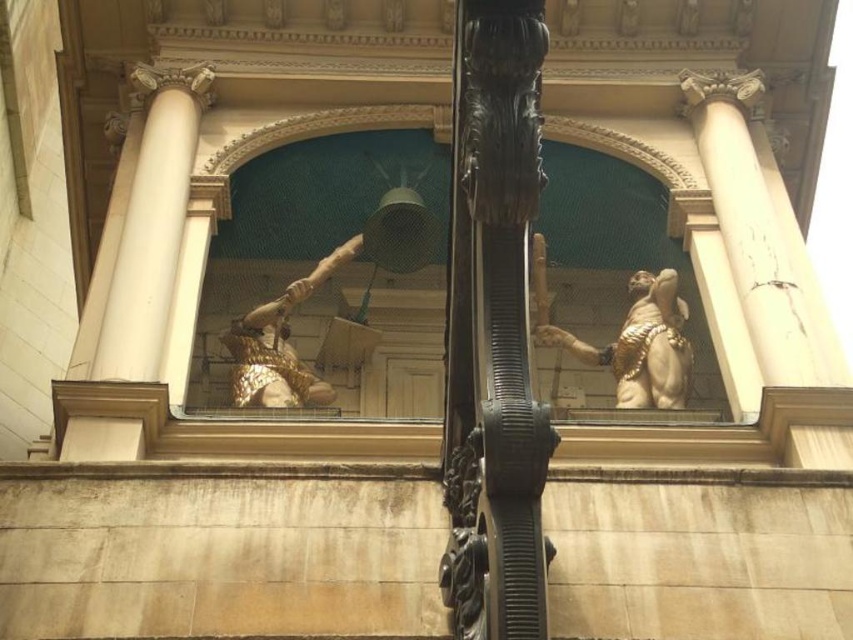
You are an architect examining the building facade. You notice a point at coordinates (135, 266). Which object on the facade does this point correspond to?

The point at coordinates (135, 266) corresponds to the white marble column at left.

You are an architect examining the building facade. You notice the white marble column at left and the gold textured armor at center. Which object is positioned higher relative to the other?

The white marble column at left is positioned higher than the gold textured armor at center because it is located above it.

You are an architect examining the building facade. You notice the black polished wood at center and the gold textured armor at center. Which object takes up more space in the scene?

The black polished wood at center has a larger size compared to the gold textured armor at center, so it takes up more space in the scene.